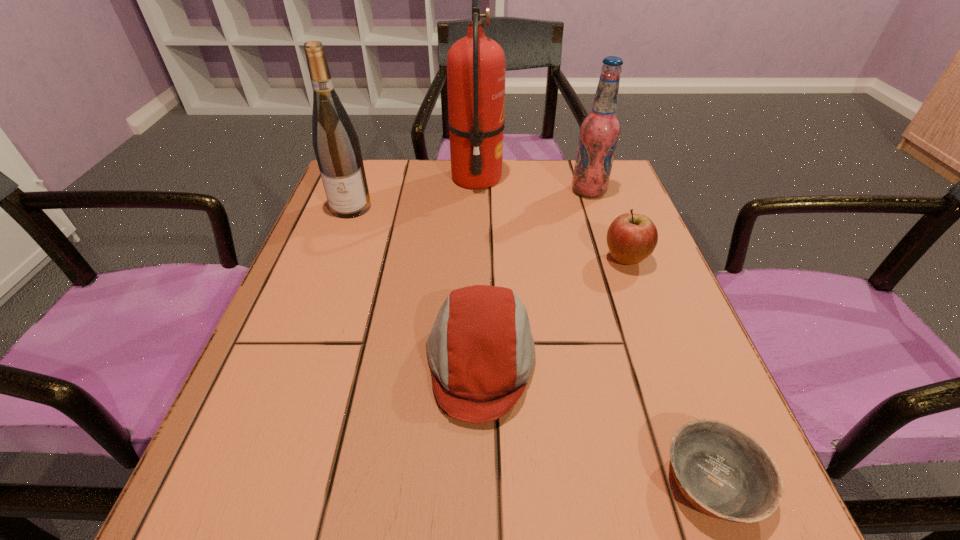
The image size is (960, 540). I want to click on object that stands as the fourth closest to the fire extinguisher, so click(481, 352).

Choose which object is the fifth nearest neighbor to the fire extinguisher. Please provide its 2D coordinates. Your answer should be formatted as a tuple, i.e. [(x, y)], where the tuple contains the x and y coordinates of a point satisfying the conditions above.

[(721, 470)]

This screenshot has width=960, height=540. Find the location of `blank area in the image that satisfies the following two spatial constraints: 1. on the side of the fire extinguisher with the nozzle and handle; 2. on the right side of the shortest object`. blank area in the image that satisfies the following two spatial constraints: 1. on the side of the fire extinguisher with the nozzle and handle; 2. on the right side of the shortest object is located at coordinates (473, 482).

Locate an element on the screen. Image resolution: width=960 pixels, height=540 pixels. free space that satisfies the following two spatial constraints: 1. on the front-facing side of the shortest object; 2. on the right side of the cap is located at coordinates (480, 482).

What are the coordinates of `free location that satisfies the following two spatial constraints: 1. on the front-facing side of the cap; 2. on the right side of the nearest object` in the screenshot? It's located at (480, 482).

Where is `free point that satisfies the following two spatial constraints: 1. on the back side of the third tallest object; 2. on the side of the fire extinguisher with the nozzle and handle`? free point that satisfies the following two spatial constraints: 1. on the back side of the third tallest object; 2. on the side of the fire extinguisher with the nozzle and handle is located at coordinates (585, 178).

The height and width of the screenshot is (540, 960). I want to click on free space in the image that satisfies the following two spatial constraints: 1. on the front side of the apple; 2. on the left side of the fourth shortest object, so click(612, 259).

The width and height of the screenshot is (960, 540). Identify the location of vacant space that satisfies the following two spatial constraints: 1. on the side of the fire extinguisher with the nozzle and handle; 2. on the front side of the leftmost object. (476, 207).